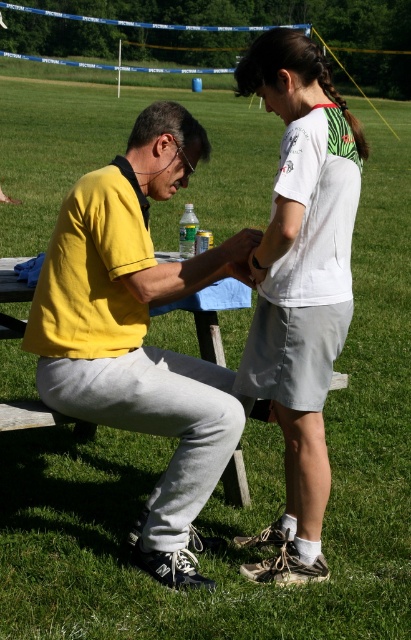
You are planning to place a small decorative item on the picnic table. The picnic table has a blue cloth placed at the center. Where should you place the item so that it is directly to the right of the yellow matte shirt at center?

The yellow matte shirt at center is located at point [138,330]. To place the item directly to the right, you would position it at a coordinate with a higher x value than 0.516 while maintaining the same y coordinate of 0.338.